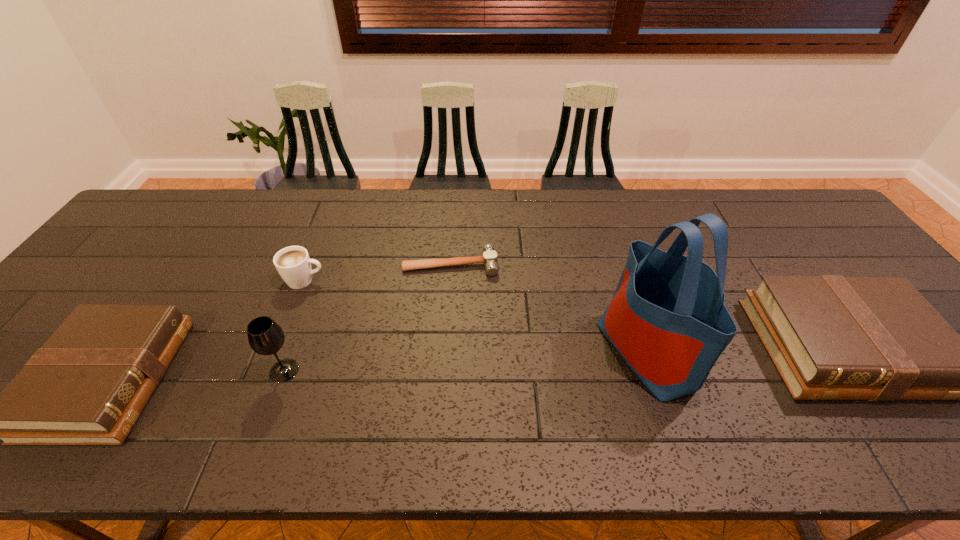
What are the coordinates of `the shorter Bible` in the screenshot? It's located at (88, 384).

At what (x,y) coordinates should I click in order to perform the action: click on the leftmost object. Please return your answer as a coordinate pair (x, y). Looking at the image, I should click on (88, 384).

You are a GUI agent. You are given a task and a screenshot of the screen. Output one action in this format:
    pyautogui.click(x=<x>, y=<y>)
    Task: Click on the cappuccino
    The height and width of the screenshot is (540, 960).
    Given the screenshot: What is the action you would take?
    pyautogui.click(x=293, y=263)

Where is `the fourth object from left to right`? This screenshot has height=540, width=960. the fourth object from left to right is located at coordinates (489, 259).

Find the location of a particular element. This screenshot has width=960, height=540. the shortest object is located at coordinates (489, 259).

What are the coordinates of `the second tallest object` in the screenshot? It's located at (265, 336).

Locate an element on the screen. the tallest object is located at coordinates (667, 319).

This screenshot has height=540, width=960. Identify the location of handbag. (667, 319).

Locate an element on the screen. This screenshot has width=960, height=540. vacant region located on the spine side of the left Bible is located at coordinates (316, 379).

This screenshot has width=960, height=540. I want to click on blank space located 0.360m with the handle on the side of the cappuccino, so click(456, 280).